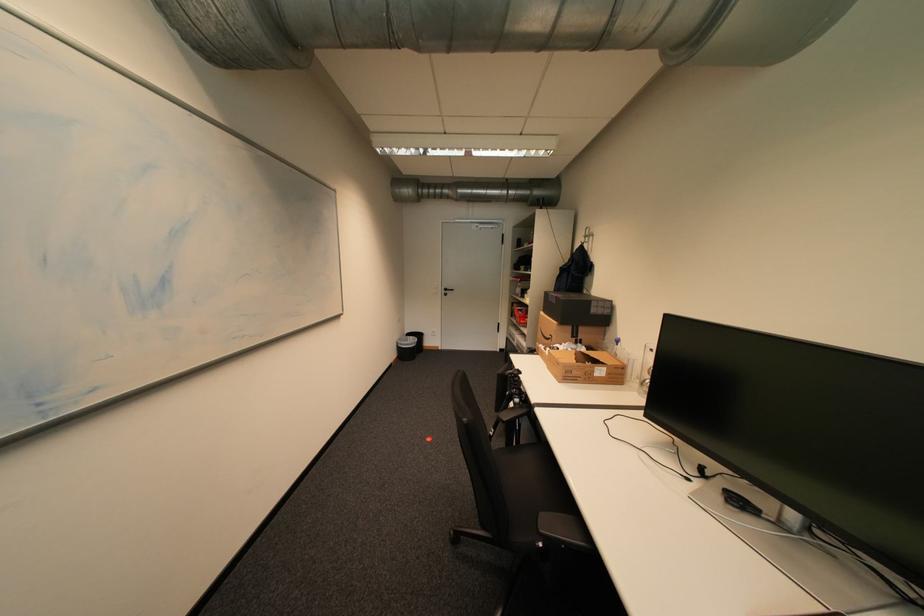
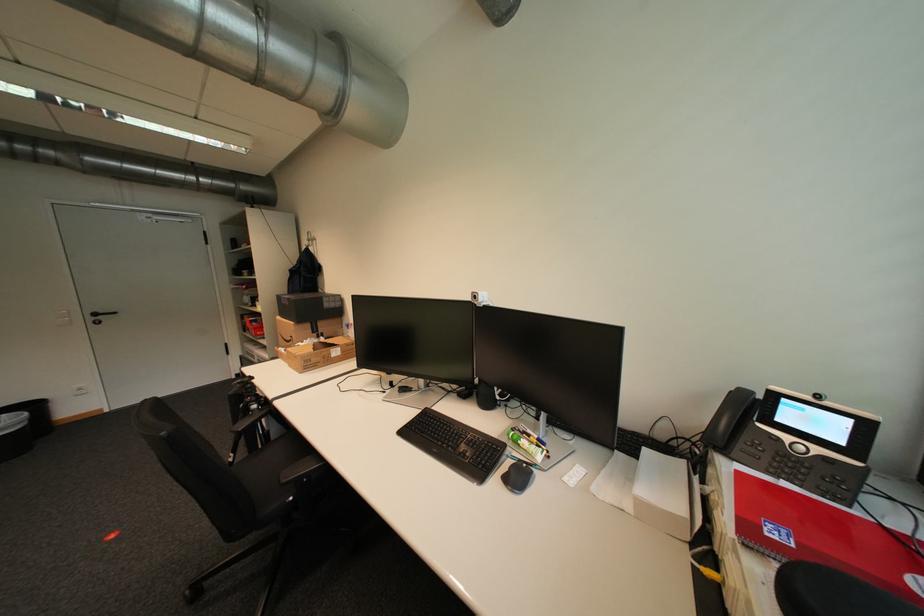
Where in the second image is the point corresponding to (x=579, y=378) from the first image?

(319, 365)